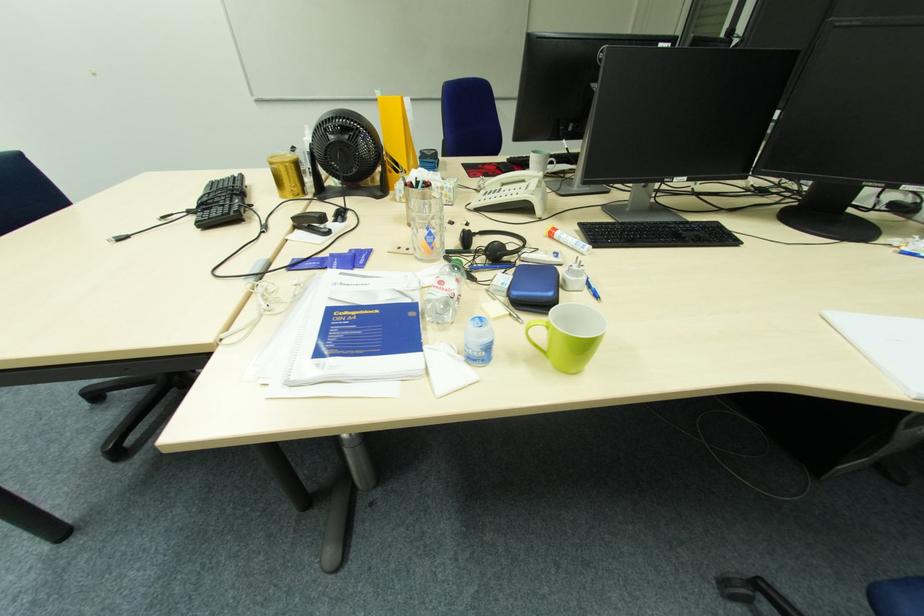
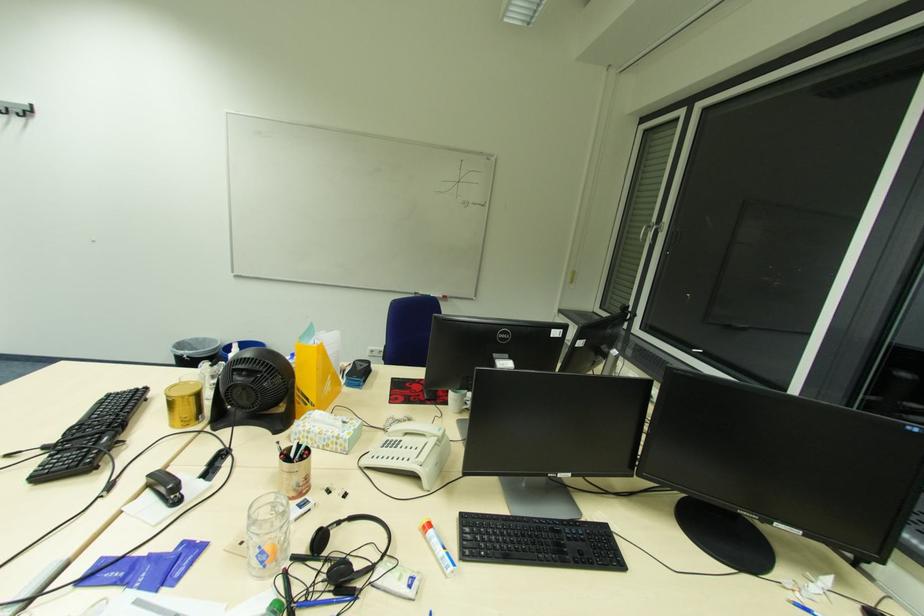
Question: The images are taken continuously from a first-person perspective. In which direction is your viewpoint rotating?

Choices:
 (A) Left
 (B) Right
 (C) Up
 (D) Down

Answer: (C)